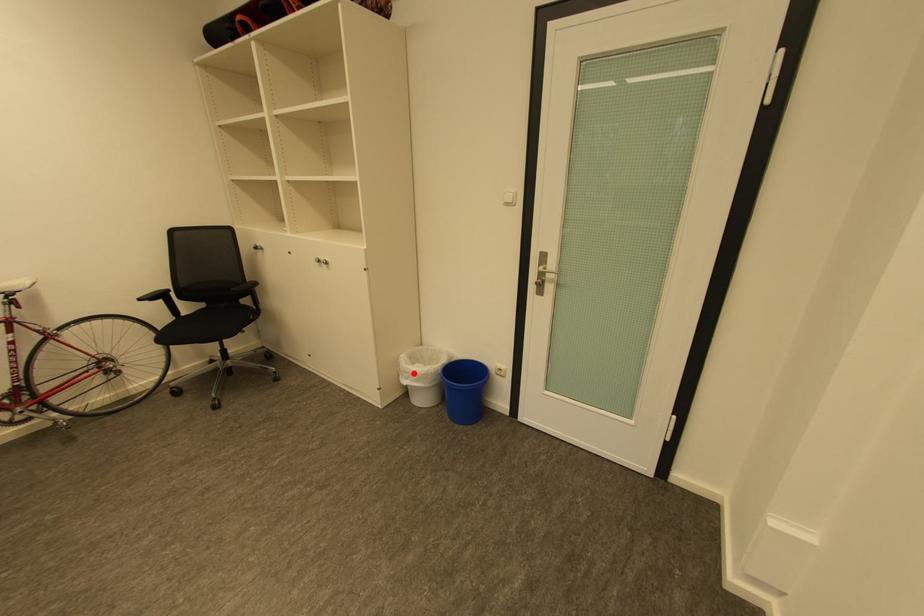
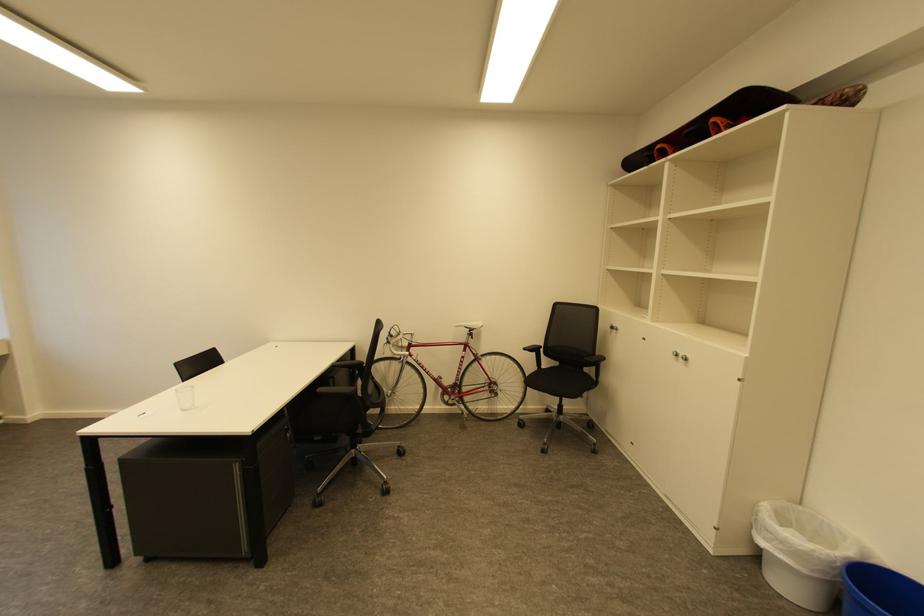
Question: I am providing you with two images of the same scene from different viewpoints. Given a red point in image1, look at the same physical point in image2. Is it:

Choices:
 (A) Closer to the viewpoint
 (B) Farther from the viewpoint

Answer: (B)